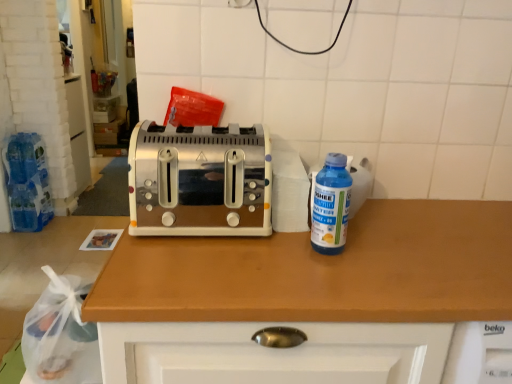
The image size is (512, 384). What do you see at coordinates (322, 271) in the screenshot?
I see `wooden countertop at center` at bounding box center [322, 271].

This screenshot has width=512, height=384. In order to click on satin silver toaster at center in this screenshot , I will do `click(200, 181)`.

From the image's perspective, which is above, satin silver toaster at center or wooden countertop at center?

satin silver toaster at center is shown above in the image.

Can you tell me how much satin silver toaster at center and wooden countertop at center differ in facing direction?

The angular difference between satin silver toaster at center and wooden countertop at center is 1.41 degrees.

You are a GUI agent. You are given a task and a screenshot of the screen. Output one action in this format:
    pyautogui.click(x=<x>, y=<y>)
    Task: Click on the toaster on the left side of wooden countertop at center
    The width and height of the screenshot is (512, 384).
    Given the screenshot: What is the action you would take?
    pyautogui.click(x=200, y=181)

Looking at this image, considering the sizes of satin silver toaster at center and wooden countertop at center in the image, is satin silver toaster at center bigger or smaller than wooden countertop at center?

satin silver toaster at center is smaller than wooden countertop at center.

Is point (136, 205) positioned behind point (343, 217)?

Yes, point (136, 205) is farther from viewer.

From a real-world perspective, who is located lower, satin silver toaster at center or blue plastic bottle at right?

From a 3D spatial view, blue plastic bottle at right is below.

From their relative heights in the image, would you say satin silver toaster at center is taller or shorter than blue plastic bottle at right?

satin silver toaster at center is taller than blue plastic bottle at right.

From the image's perspective, which object appears higher, wooden countertop at center or satin silver toaster at center?

satin silver toaster at center.

Is wooden countertop at center further to camera compared to satin silver toaster at center?

No, wooden countertop at center is in front of satin silver toaster at center.

From a real-world perspective, between wooden countertop at center and satin silver toaster at center, who is vertically lower?

wooden countertop at center.

Is wooden countertop at center not inside satin silver toaster at center?

Yes, wooden countertop at center is outside of satin silver toaster at center.

Can you confirm if blue plastic bottle at right is positioned to the right of satin silver toaster at center?

Correct, you'll find blue plastic bottle at right to the right of satin silver toaster at center.

Looking at their sizes, would you say blue plastic bottle at right is wider or thinner than satin silver toaster at center?

In the image, blue plastic bottle at right appears to be more narrow than satin silver toaster at center.

From a real-world perspective, is blue plastic bottle at right located beneath satin silver toaster at center?

Yes, from a real-world perspective, blue plastic bottle at right is under satin silver toaster at center.

Which is correct: blue plastic bottle at right is inside satin silver toaster at center, or outside of it?

blue plastic bottle at right exists outside the volume of satin silver toaster at center.

Can you confirm if wooden countertop at center is taller than blue plastic bottle at right?

Yes.

From a real-world perspective, is wooden countertop at center on blue plastic bottle at right?

Incorrect, from a real-world perspective, wooden countertop at center is lower than blue plastic bottle at right.

Who is smaller, wooden countertop at center or blue plastic bottle at right?

Smaller between the two is blue plastic bottle at right.

From the image's perspective, between wooden countertop at center and blue plastic bottle at right, which one is located above?

blue plastic bottle at right.

Considering the points (343, 202) and (510, 268), which point is behind, point (343, 202) or point (510, 268)?

The point (510, 268) is more distant.

Is blue plastic bottle at right to the left of wooden countertop at center from the viewer's perspective?

In fact, blue plastic bottle at right is to the right of wooden countertop at center.

Looking at their sizes, would you say blue plastic bottle at right is wider or thinner than wooden countertop at center?

Clearly, blue plastic bottle at right has less width compared to wooden countertop at center.

Find the location of `countertop located in front of the satin silver toaster at center`. countertop located in front of the satin silver toaster at center is located at coordinates (322, 271).

Locate an element on the screen. bottle that appears below the satin silver toaster at center (from the image's perspective) is located at coordinates (331, 206).

Considering their positions, is blue plastic bottle at right positioned closer to satin silver toaster at center than wooden countertop at center?

wooden countertop at center.

Based on their spatial positions, is satin silver toaster at center or wooden countertop at center further from blue plastic bottle at right?

Result: satin silver toaster at center is positioned further to the anchor blue plastic bottle at right.

From the image, which object appears to be farther from wooden countertop at center, blue plastic bottle at right or satin silver toaster at center?

The object further to wooden countertop at center is blue plastic bottle at right.

Based on the photo, estimate the real-world distances between objects in this image. Which object is further from blue plastic bottle at right, wooden countertop at center or satin silver toaster at center?

The object further to blue plastic bottle at right is satin silver toaster at center.

Estimate the real-world distances between objects in this image. Which object is further from satin silver toaster at center, wooden countertop at center or blue plastic bottle at right?

blue plastic bottle at right lies further to satin silver toaster at center than the other object.

Consider the image. From the image, which object appears to be farther from wooden countertop at center, satin silver toaster at center or blue plastic bottle at right?

The object further to wooden countertop at center is blue plastic bottle at right.

Locate an element on the screen. This screenshot has height=384, width=512. bottle that lies between satin silver toaster at center and wooden countertop at center from top to bottom is located at coordinates (331, 206).